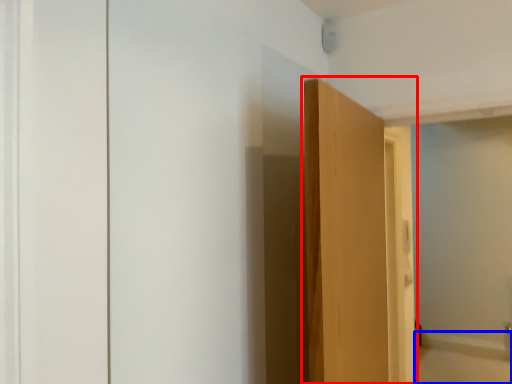
Question: Which object is further to the camera taking this photo, door (highlighted by a red box) or bath (highlighted by a blue box)?

Choices:
 (A) door
 (B) bath

Answer: (B)